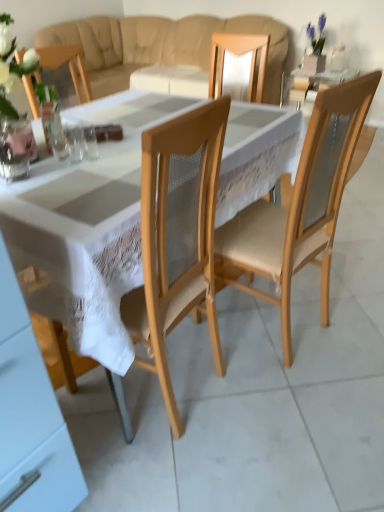
Where is `free point in front of natural wood chair at center`? Image resolution: width=384 pixels, height=512 pixels. free point in front of natural wood chair at center is located at coordinates (291, 407).